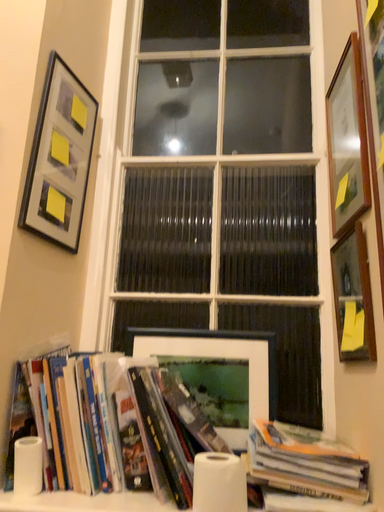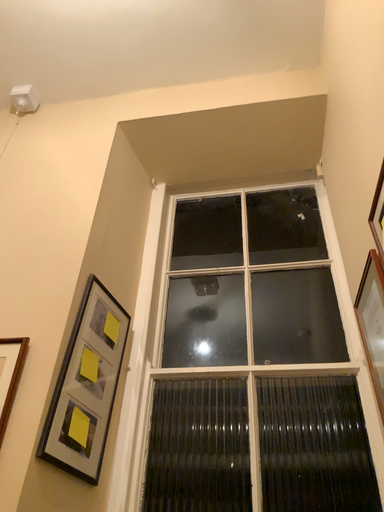
Question: How did the camera likely rotate when shooting the video?

Choices:
 (A) rotated downward
 (B) rotated upward

Answer: (B)